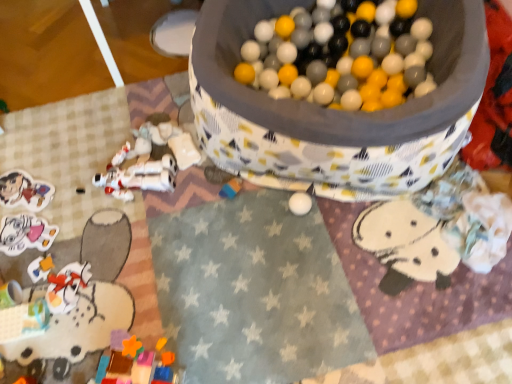
What are the coordinates of `empty space that is to the right of matte cardboard sticker at lower left, which is the first toy in left-to-right order` in the screenshot? It's located at (78, 193).